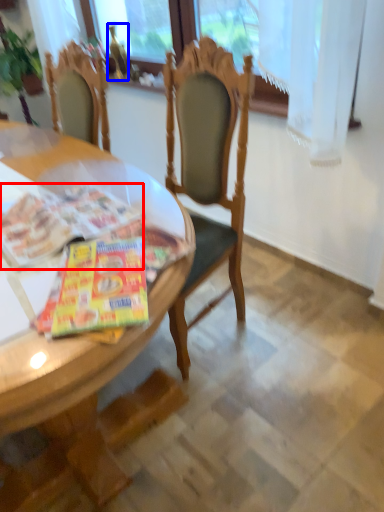
Question: Which of the following is the closest to the observer, magazine (highlighted by a red box) or bottle (highlighted by a blue box)?

Choices:
 (A) magazine
 (B) bottle

Answer: (A)